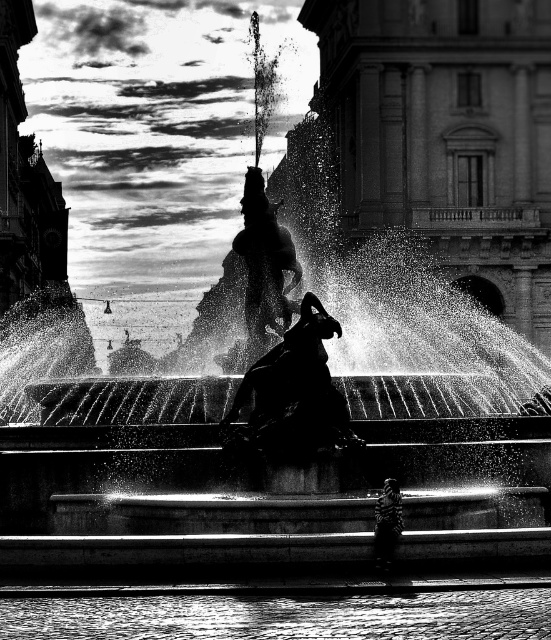
Question: Which of the following is the farthest from the observer?

Choices:
 (A) pyautogui.click(x=255, y=323)
 (B) pyautogui.click(x=299, y=353)
 (C) pyautogui.click(x=377, y=545)

Answer: (A)

Question: Can you confirm if silhouette stone statue at center is thinner than zebra-striped fabric at lower center?

Choices:
 (A) no
 (B) yes

Answer: (A)

Question: Is smooth stone statue at center wider than zebra-striped fabric at lower center?

Choices:
 (A) yes
 (B) no

Answer: (A)

Question: Is silhouette stone statue at center closer to the viewer compared to zebra-striped fabric at lower center?

Choices:
 (A) no
 (B) yes

Answer: (A)

Question: Which point is farther from the camera taking this photo?

Choices:
 (A) 390,563
 (B) 293,273

Answer: (B)

Question: Which point is closer to the camera?

Choices:
 (A) (285, 384)
 (B) (269, 291)
 (C) (375, 532)

Answer: (C)